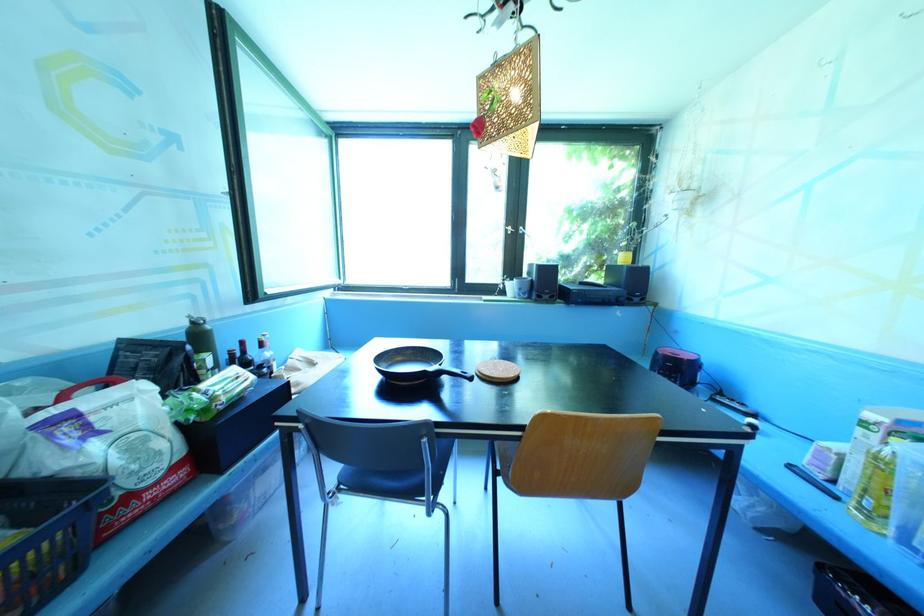
This screenshot has height=616, width=924. What are the coordinates of `grey chair sitting surface` in the screenshot? It's located at (398, 477).